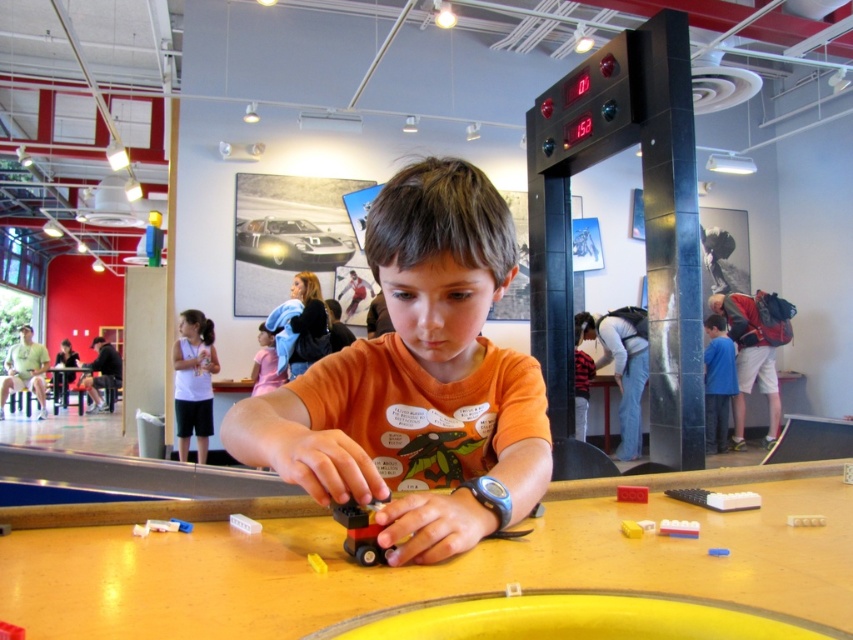
Can you confirm if blue cotton shirt at right is smaller than brick-like plastic car at center?

No, blue cotton shirt at right is not smaller than brick-like plastic car at center.

Is blue cotton shirt at right bigger than brick-like plastic car at center?

Yes.

Between point (711, 346) and point (363, 538), which one is positioned in front?

Positioned in front is point (363, 538).

Where is `blue cotton shirt at right`? blue cotton shirt at right is located at coordinates (717, 381).

Is blue cotton shirt at right positioned before white plastic toy at center?

That is False.

Image resolution: width=853 pixels, height=640 pixels. In order to click on blue cotton shirt at right in this screenshot , I will do click(717, 381).

Is point (392, 429) less distant than point (802, 515)?

Yes, point (392, 429) is closer to viewer.

Does point (451, 432) come behind point (796, 518)?

Yes, it is.

Where is `orange matte shirt at center`? This screenshot has height=640, width=853. orange matte shirt at center is located at coordinates (418, 381).